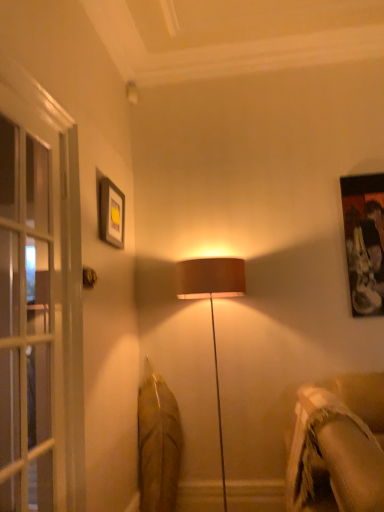
Question: Is beige textured fabric couch at lower right to the left or to the right of metallic gold door handle at upper left in the image?

Choices:
 (A) left
 (B) right

Answer: (B)

Question: From the image's perspective, is beige textured fabric couch at lower right located above or below metallic gold door handle at upper left?

Choices:
 (A) below
 (B) above

Answer: (A)

Question: Which is farther from the clear glass screen door at left?

Choices:
 (A) beige textured fabric couch at lower right
 (B) metallic gold door handle at upper left
 (C) matte black picture frame at upper left

Answer: (A)

Question: Which object is positioned farthest from the beige textured fabric couch at lower right?

Choices:
 (A) matte black picture frame at upper left
 (B) metallic gold door handle at upper left
 (C) clear glass screen door at left

Answer: (A)